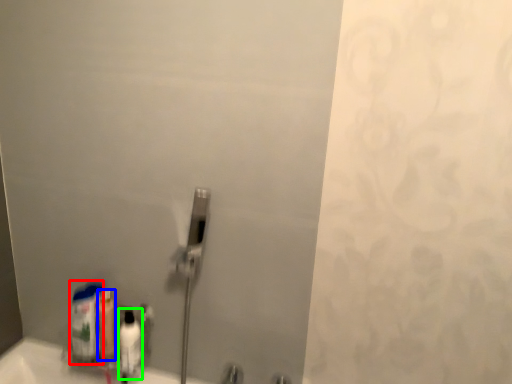
Question: Which is farther away from cleaning product (highlighted by a red box)? mouthwash (highlighted by a blue box) or mouthwash (highlighted by a green box)?

Choices:
 (A) mouthwash
 (B) mouthwash

Answer: (B)